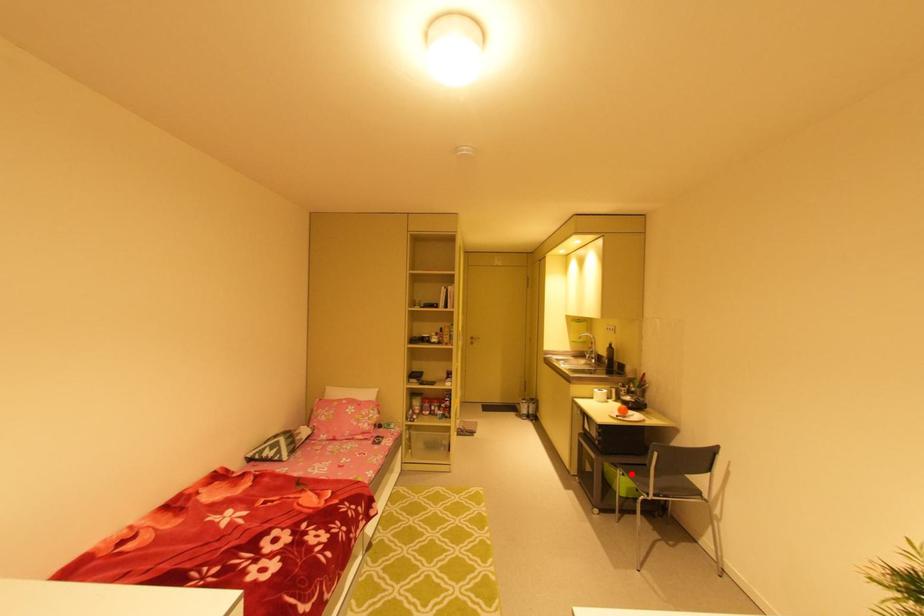
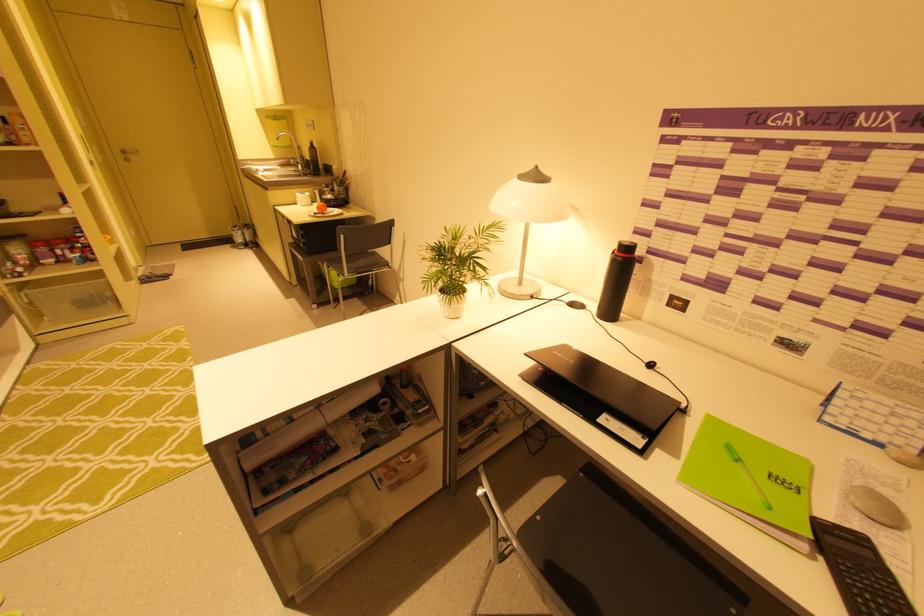
Locate, in the second image, the point that corresponds to the highlighted location in the first image.

(334, 265)